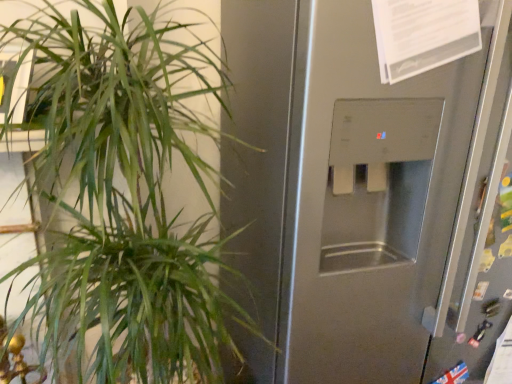
Question: Considering the positions of satin silver dispenser at center and green leafy plant at left in the image, is satin silver dispenser at center wider or thinner than green leafy plant at left?

Choices:
 (A) wide
 (B) thin

Answer: (A)

Question: In the image, is satin silver dispenser at center on the left side or the right side of green leafy plant at left?

Choices:
 (A) right
 (B) left

Answer: (A)

Question: Considering their positions, is satin silver dispenser at center located in front of or behind green leafy plant at left?

Choices:
 (A) front
 (B) behind

Answer: (B)

Question: Is green leafy plant at left wider or thinner than satin silver dispenser at center?

Choices:
 (A) wide
 (B) thin

Answer: (B)

Question: In terms of size, does green leafy plant at left appear bigger or smaller than satin silver dispenser at center?

Choices:
 (A) big
 (B) small

Answer: (B)

Question: Is green leafy plant at left inside the boundaries of satin silver dispenser at center, or outside?

Choices:
 (A) outside
 (B) inside

Answer: (A)

Question: Based on their positions, is green leafy plant at left located to the left or right of satin silver dispenser at center?

Choices:
 (A) right
 (B) left

Answer: (B)